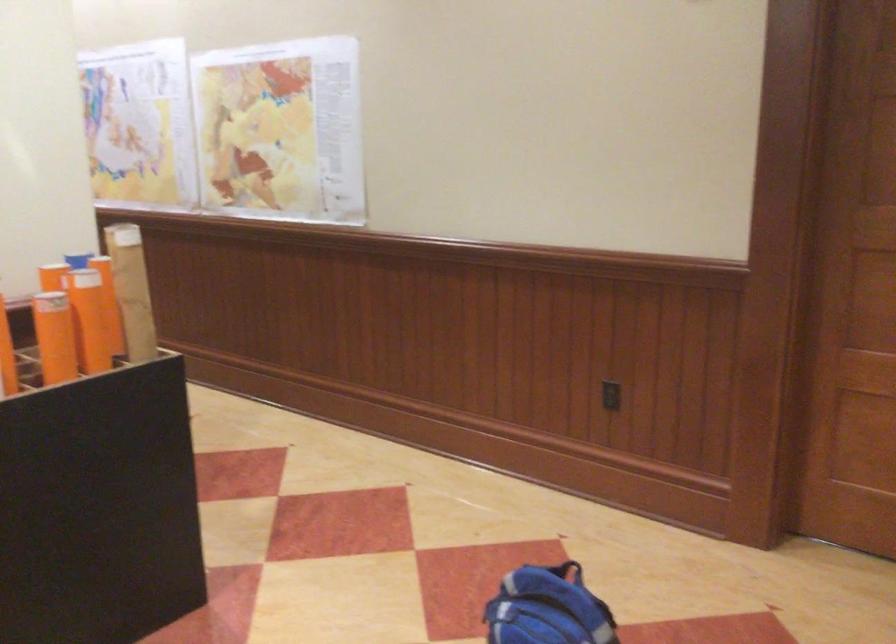
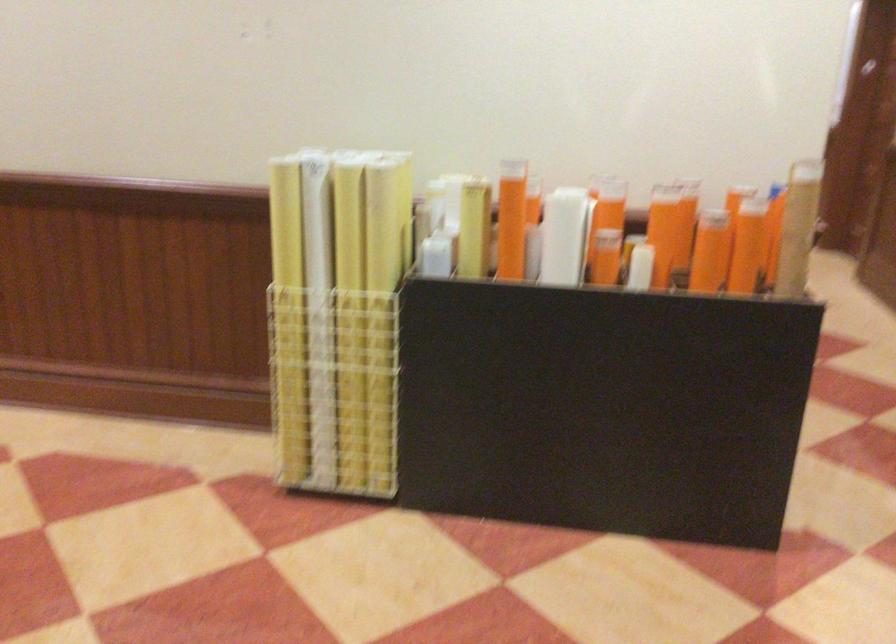
Question: I am providing you with two images of the same scene from different viewpoints. Please identify which objects are invisible in image2.

Choices:
 (A) orange paper tube
 (B) white rolled paper
 (C) yellow rolled paper
 (D) purple soap dispenser pump

Answer: (A)